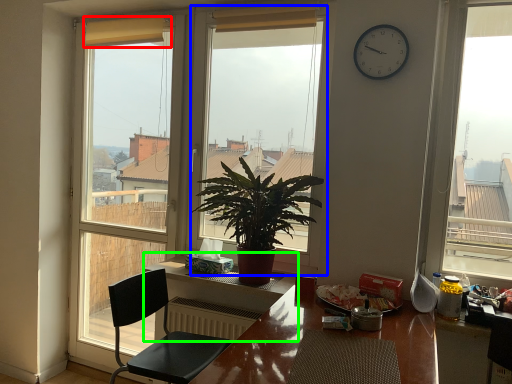
Question: Estimate the real-world distances between objects in this image. Which object is farther from curtain (highlighted by a red box), window (highlighted by a blue box) or table (highlighted by a green box)?

Choices:
 (A) window
 (B) table

Answer: (A)